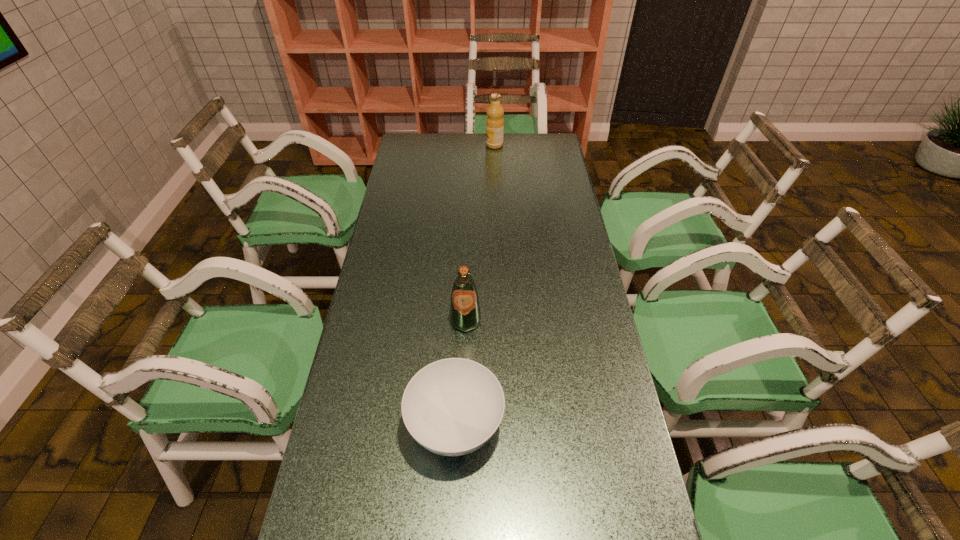
The width and height of the screenshot is (960, 540). What are the coordinates of `blank area located 0.380m on the back of the nearest object` in the screenshot? It's located at (461, 281).

This screenshot has height=540, width=960. I want to click on object that is at the far edge, so click(x=494, y=123).

Find the location of a particular element. This screenshot has width=960, height=540. free spot at the far edge of the desktop is located at coordinates (522, 139).

Where is `blank area at the left edge`? The width and height of the screenshot is (960, 540). blank area at the left edge is located at coordinates (372, 433).

Locate an element on the screen. free point at the right edge is located at coordinates (603, 383).

Identify the location of free space between the left olive oil and the farthest object. (480, 233).

At what (x,y) coordinates should I click in order to perform the action: click on free area in between the right olive oil and the nearer olive oil. Please return your answer as a coordinate pair (x, y). The width and height of the screenshot is (960, 540). Looking at the image, I should click on (480, 233).

Where is `free spot between the left olive oil and the farthest object`? free spot between the left olive oil and the farthest object is located at coordinates (480, 233).

Point out which object is positioned as the second nearest to the right olive oil. Please provide its 2D coordinates. Your answer should be formatted as a tuple, i.e. [(x, y)], where the tuple contains the x and y coordinates of a point satisfying the conditions above.

[(452, 407)]

Select which object appears as the closest to the farthest object. Please provide its 2D coordinates. Your answer should be formatted as a tuple, i.e. [(x, y)], where the tuple contains the x and y coordinates of a point satisfying the conditions above.

[(465, 315)]